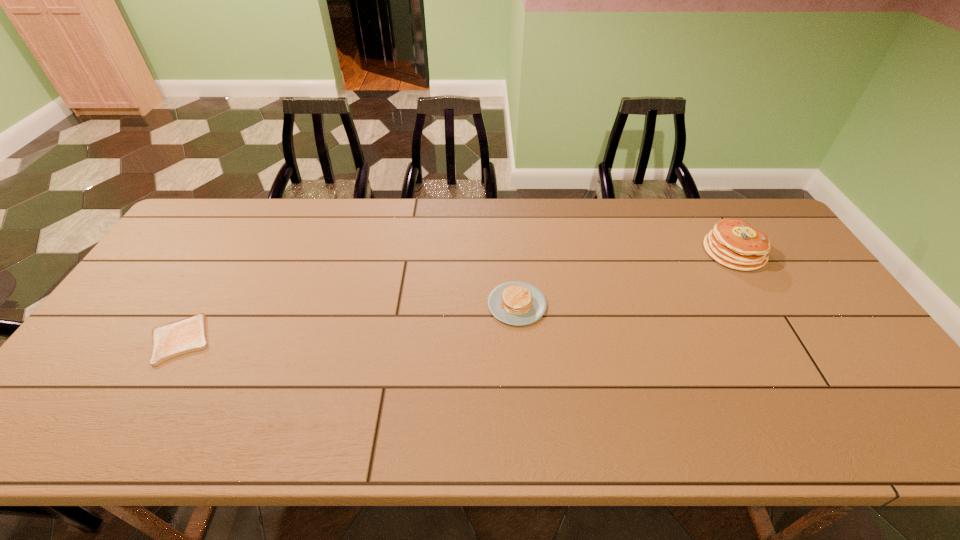
Identify the location of empty location between the shorter pancake and the leftmost object. Image resolution: width=960 pixels, height=540 pixels. (348, 322).

Where is `vacant area between the left pancake and the leftmost object`? The height and width of the screenshot is (540, 960). vacant area between the left pancake and the leftmost object is located at coordinates (348, 322).

What are the coordinates of `free space between the second tallest object and the tallest object` in the screenshot? It's located at (625, 278).

Identify the location of free spot between the second shortest object and the toast. The width and height of the screenshot is (960, 540). (348, 322).

I want to click on free space between the second object from left to right and the toast, so click(348, 322).

Locate an element on the screen. This screenshot has width=960, height=540. free space between the second object from left to right and the shortest object is located at coordinates (348, 322).

This screenshot has height=540, width=960. I want to click on vacant region between the second tallest object and the taller pancake, so click(625, 278).

Locate an element on the screen. free spot between the right pancake and the second tallest object is located at coordinates (625, 278).

Locate an element on the screen. The height and width of the screenshot is (540, 960). free space that is in between the second object from right to left and the leftmost object is located at coordinates (348, 322).

Find the location of a particular element. the closest object relative to the shorter pancake is located at coordinates (733, 243).